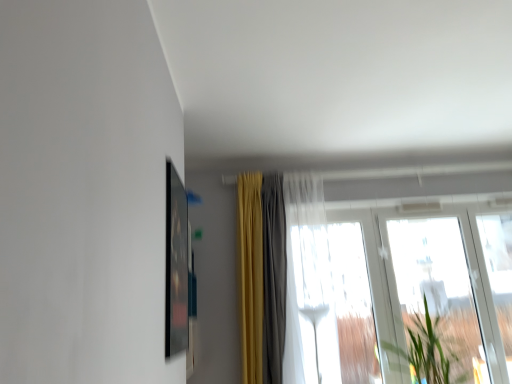
Question: From a real-world perspective, is matte black picture frame at upper left above or below green leafy plant at right?

Choices:
 (A) below
 (B) above

Answer: (B)

Question: Visually, is matte black picture frame at upper left positioned to the left or to the right of green leafy plant at right?

Choices:
 (A) left
 (B) right

Answer: (A)

Question: Estimate the real-world distances between objects in this image. Which object is farther from the matte black picture frame at upper left?

Choices:
 (A) green leafy plant at right
 (B) transparent glass window at center, the second window positioned from the left
 (C) transparent glass window at right, which appears as the first window when viewed from the right
 (D) yellow fabric curtain at center, the 1th curtain in the right-to-left sequence
 (E) velvet yellow curtain at center, the second curtain from the right

Answer: (C)

Question: Which object is the farthest from the green leafy plant at right?

Choices:
 (A) transparent glass window at right, which appears as the first window when viewed from the right
 (B) matte black picture frame at upper left
 (C) velvet yellow curtain at center, which is the first curtain in left-to-right order
 (D) yellow fabric curtain at center, the 1th curtain in the right-to-left sequence
 (E) transparent glass window at center, the second window positioned from the right

Answer: (B)